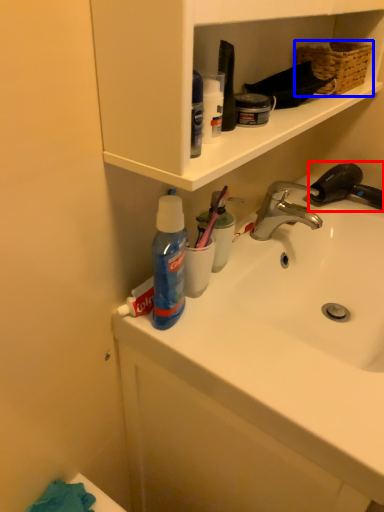
Question: Which point is closer to the camera, faucet (highlighted by a red box) or basket (highlighted by a blue box)?

Choices:
 (A) faucet
 (B) basket

Answer: (B)